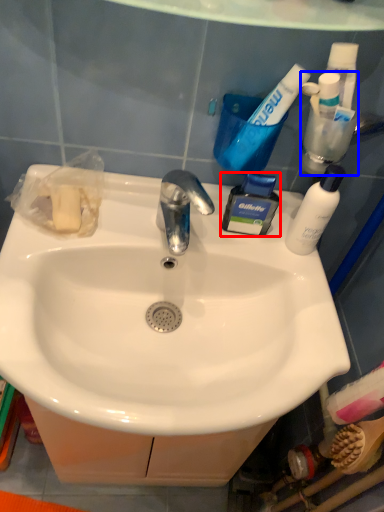
Question: Which point is further to the camera, toiletry (highlighted by a red box) or toiletry (highlighted by a blue box)?

Choices:
 (A) toiletry
 (B) toiletry

Answer: (A)